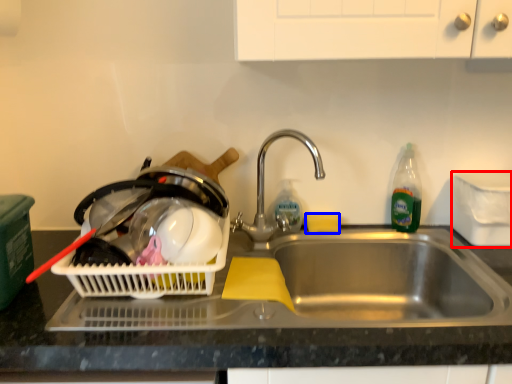
Question: Among these objects, which one is farthest to the camera, appliance (highlighted by a red box) or food (highlighted by a blue box)?

Choices:
 (A) appliance
 (B) food

Answer: (B)